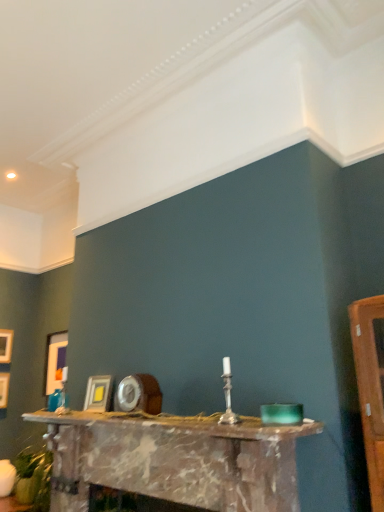
Question: Is matte white picture frame at left, the 3th picture frame in the back-to-front sequence, to the left of wooden picture frame at left, the fourth picture frame in the right-to-left sequence, from the viewer's perspective?

Choices:
 (A) no
 (B) yes

Answer: (A)

Question: Considering the relative sizes of matte white picture frame at left, the second picture frame in the right-to-left sequence, and wooden picture frame at left, positioned as the first picture frame in left-to-right order, in the image provided, is matte white picture frame at left, the second picture frame in the right-to-left sequence, thinner than wooden picture frame at left, positioned as the first picture frame in left-to-right order,?

Choices:
 (A) no
 (B) yes

Answer: (A)

Question: Considering the relative sizes of matte white picture frame at left, the second picture frame from the front, and wooden picture frame at left, positioned as the 4th picture frame in front-to-back order, in the image provided, is matte white picture frame at left, the second picture frame from the front, taller than wooden picture frame at left, positioned as the 4th picture frame in front-to-back order,?

Choices:
 (A) no
 (B) yes

Answer: (B)

Question: Is matte white picture frame at left, which ranks as the third picture frame in left-to-right order, not inside wooden picture frame at left, positioned as the 4th picture frame in front-to-back order?

Choices:
 (A) no
 (B) yes

Answer: (B)

Question: Is matte white picture frame at left, the second picture frame in the right-to-left sequence, in front of wooden picture frame at left, the fourth picture frame in the right-to-left sequence?

Choices:
 (A) yes
 (B) no

Answer: (A)

Question: Is wooden picture frame at left, positioned as the first picture frame in left-to-right order, a part of matte white picture frame at left, the 3th picture frame in the back-to-front sequence?

Choices:
 (A) yes
 (B) no

Answer: (B)

Question: Is matte gold picture frame at left, which ranks as the second picture frame in back-to-front order, taller than marble fireplace at center?

Choices:
 (A) yes
 (B) no

Answer: (B)

Question: Is matte gold picture frame at left, which ranks as the second picture frame in back-to-front order, shorter than marble fireplace at center?

Choices:
 (A) yes
 (B) no

Answer: (A)

Question: From a real-world perspective, is matte gold picture frame at left, arranged as the third picture frame when viewed from the right, positioned under marble fireplace at center based on gravity?

Choices:
 (A) no
 (B) yes

Answer: (A)

Question: From the image's perspective, is matte gold picture frame at left, the third picture frame viewed from the front, on marble fireplace at center?

Choices:
 (A) no
 (B) yes

Answer: (B)

Question: Does matte gold picture frame at left, which ranks as the second picture frame in back-to-front order, come in front of marble fireplace at center?

Choices:
 (A) no
 (B) yes

Answer: (A)

Question: Is matte gold picture frame at left, which ranks as the second picture frame in back-to-front order, next to marble fireplace at center and touching it?

Choices:
 (A) yes
 (B) no

Answer: (B)

Question: Is matte gold picture frame at left, arranged as the third picture frame when viewed from the right, to the right of matte gold picture frame at center, the 1th picture frame from the right, from the viewer's perspective?

Choices:
 (A) no
 (B) yes

Answer: (A)